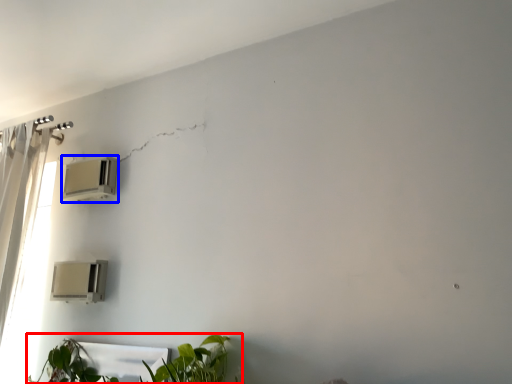
Question: Which of the following is the farthest to the observer, houseplant (highlighted by a red box) or air conditioning (highlighted by a blue box)?

Choices:
 (A) houseplant
 (B) air conditioning

Answer: (B)